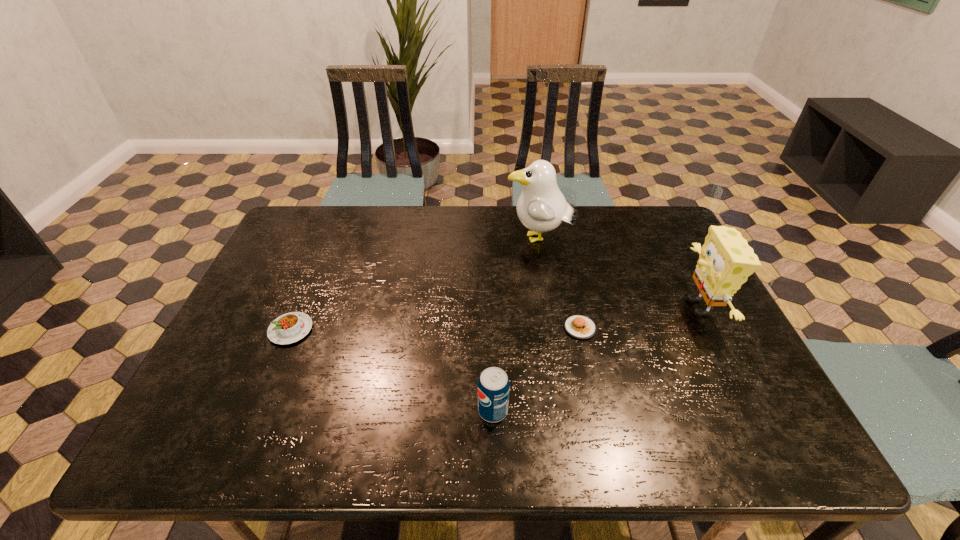
The image size is (960, 540). In order to click on vacant space that satisfies the following two spatial constraints: 1. on the back side of the food; 2. on the beak of the gull in this screenshot , I will do (x=561, y=240).

Where is `blank area in the image that satisfies the following two spatial constraints: 1. on the face of the sponge; 2. on the front side of the shortest object`? This screenshot has height=540, width=960. blank area in the image that satisfies the following two spatial constraints: 1. on the face of the sponge; 2. on the front side of the shortest object is located at coordinates (709, 328).